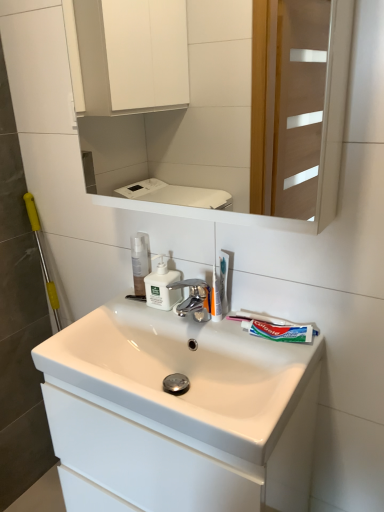
The image size is (384, 512). In order to click on vacant region in front of translucent plastic toothbrush at upper center in this screenshot , I will do `click(248, 340)`.